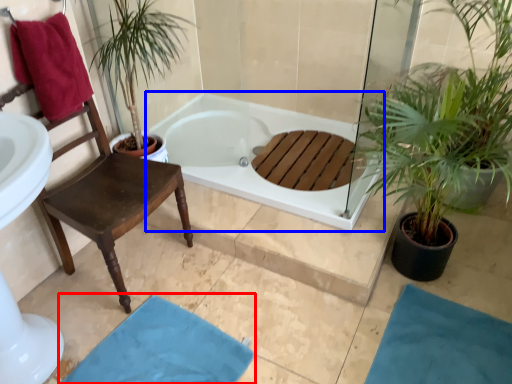
Question: Which object is closer to the camera taking this photo, bath mat (highlighted by a red box) or bathtub (highlighted by a blue box)?

Choices:
 (A) bath mat
 (B) bathtub

Answer: (A)